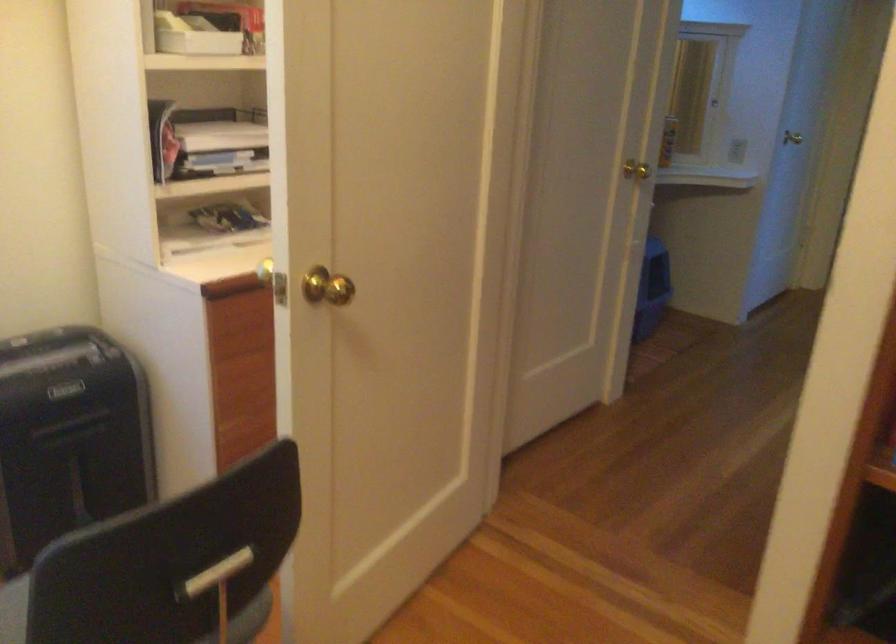
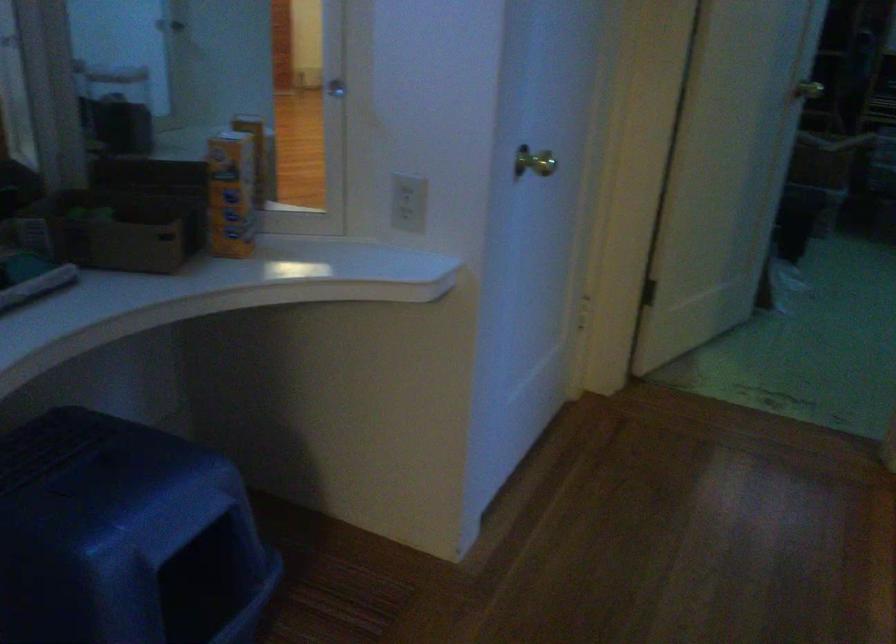
Where in the second image is the point corresponding to (x=737, y=147) from the first image?

(409, 202)